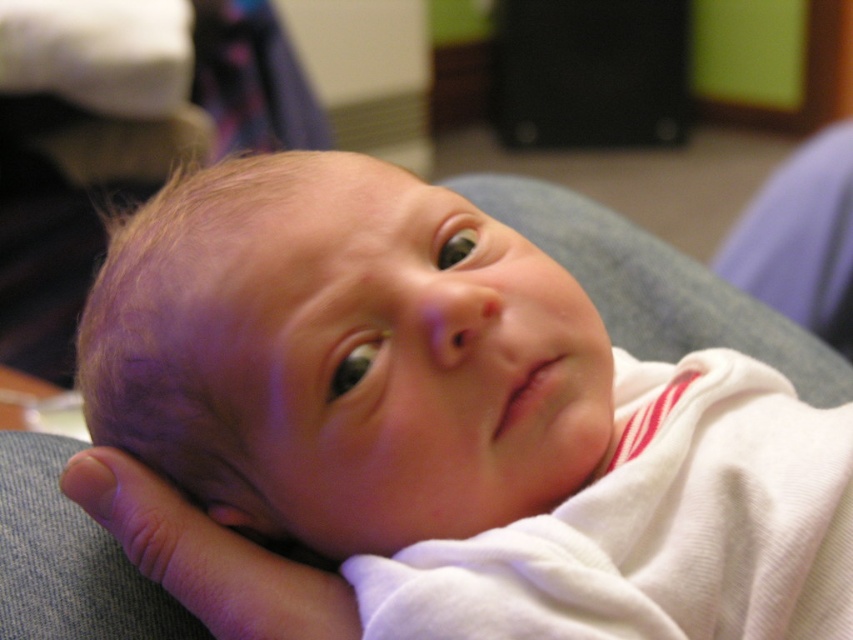
Question: Which of the following is the farthest from the observer?

Choices:
 (A) white soft baby at center
 (B) smooth skin hand at lower left

Answer: (B)

Question: Can you confirm if white soft baby at center is smaller than smooth skin hand at lower left?

Choices:
 (A) yes
 (B) no

Answer: (B)

Question: Does white soft baby at center have a lesser width compared to smooth skin hand at lower left?

Choices:
 (A) yes
 (B) no

Answer: (B)

Question: Can you confirm if white soft baby at center is thinner than smooth skin hand at lower left?

Choices:
 (A) yes
 (B) no

Answer: (B)

Question: Which point is farther to the camera?

Choices:
 (A) smooth skin hand at lower left
 (B) white soft baby at center

Answer: (A)